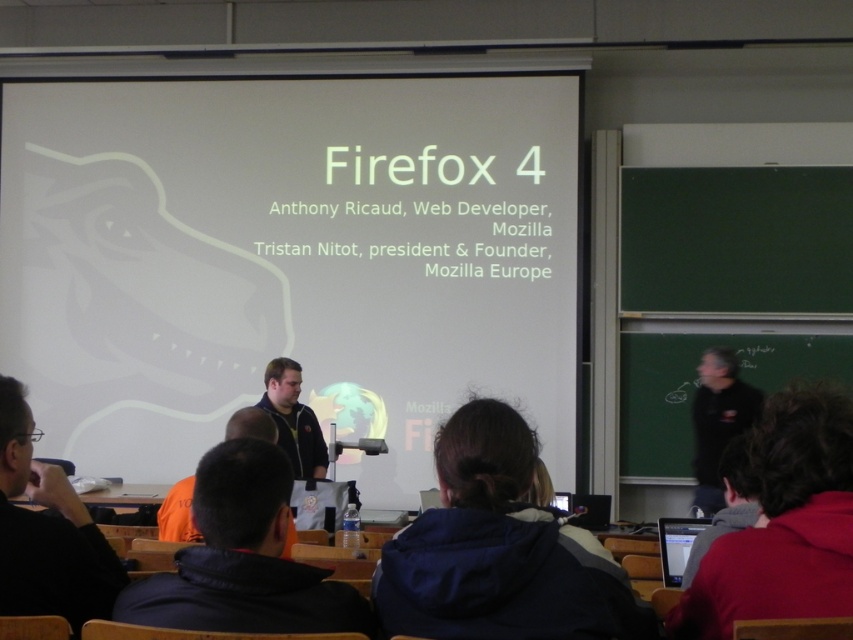
You are standing in the classroom and want to take a photo of the white matte projection screen at center. Where should you position yourself to ensure the screen is centered in your camera viewfinder?

To center the white matte projection screen at center in your camera viewfinder, position yourself directly in front of the screen at its 2D coordinates point (288, 260).

You are a student sitting at point (206,352) and want to move to the front of the classroom to ask a question. Can you walk directly in front of point (189,490) to reach the front?

Point (206,352) is behind point (189,490), so you cannot walk directly in front of point (189,490) to reach the front because you are already behind it.

You are a photographer in the classroom and want to take a photo of the white matte projection screen at center and the dark blue shirt at center. Which object should you focus on first if you want both to be in sharp focus?

The white matte projection screen at center is bigger than the dark blue shirt at center, so you should focus on the white matte projection screen at center first to ensure both are in sharp focus.